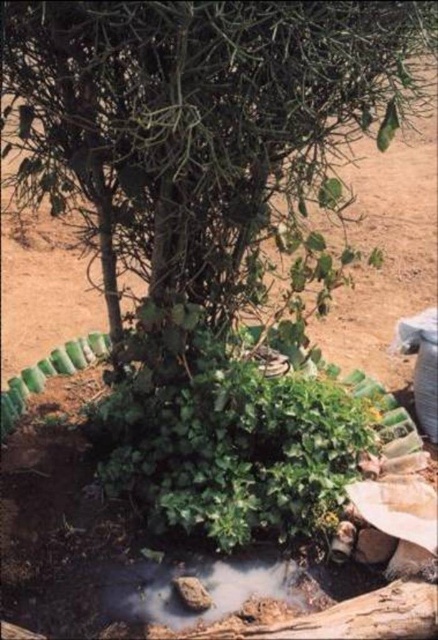
Is green matte tree at center wider than brown dirt puddle at lower center?

Correct, the width of green matte tree at center exceeds that of brown dirt puddle at lower center.

Can you confirm if green matte tree at center is bigger than brown dirt puddle at lower center?

Correct, green matte tree at center is larger in size than brown dirt puddle at lower center.

Identify the location of green matte tree at center. (209, 129).